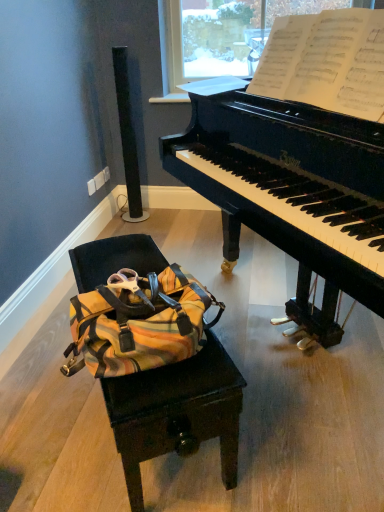
Locate an element on the screen. The image size is (384, 512). vacant point to the left of leather-like black table at lower left is located at coordinates (48, 399).